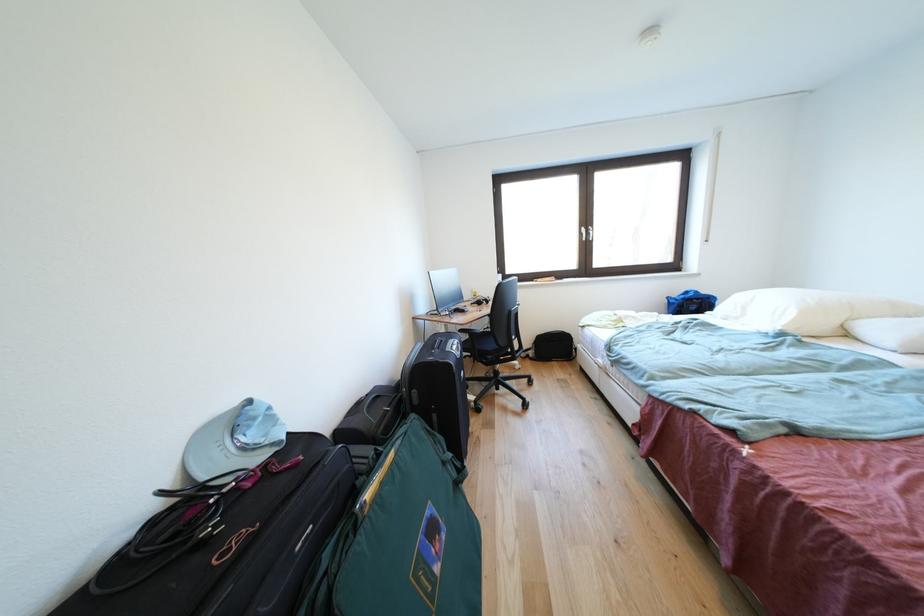
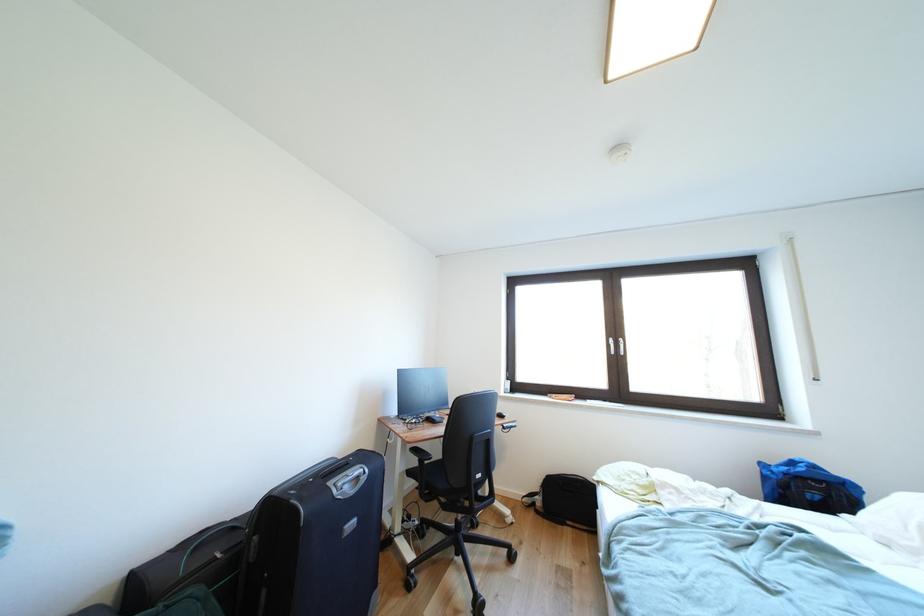
The first image is from the beginning of the video and the second image is from the end. How did the camera likely rotate when shooting the video?

The camera rotated toward left-up.